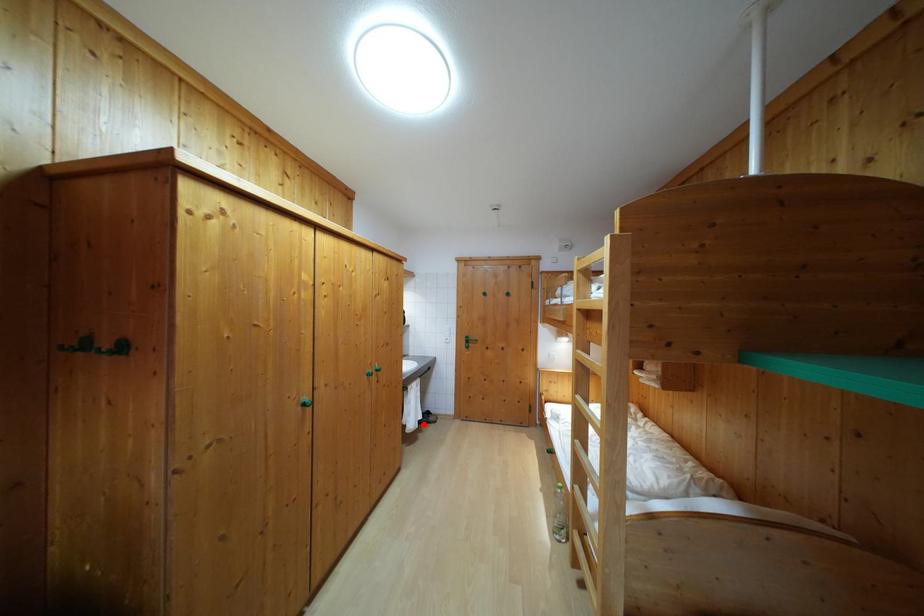
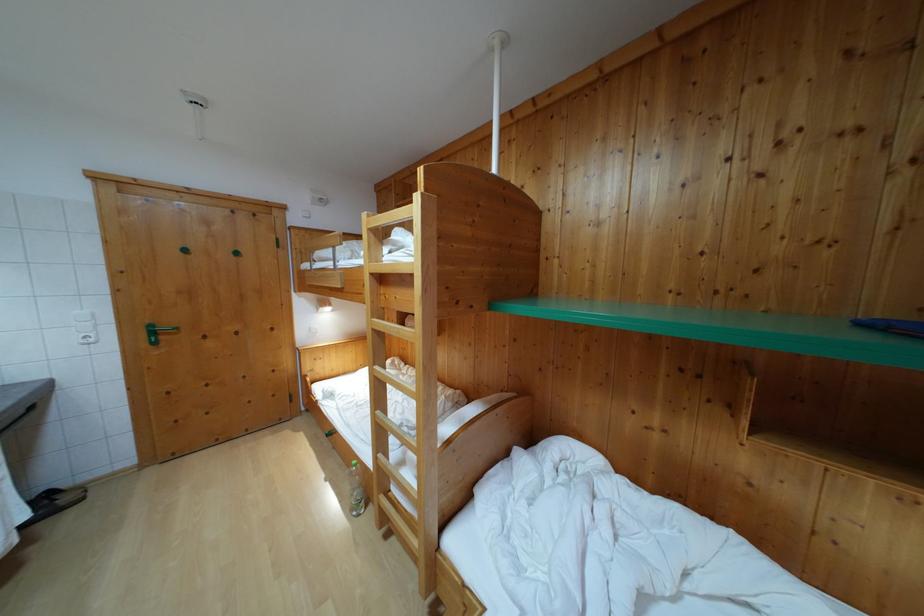
Where in the second image is the point corresponding to the highlighted location from the first image?

(28, 524)